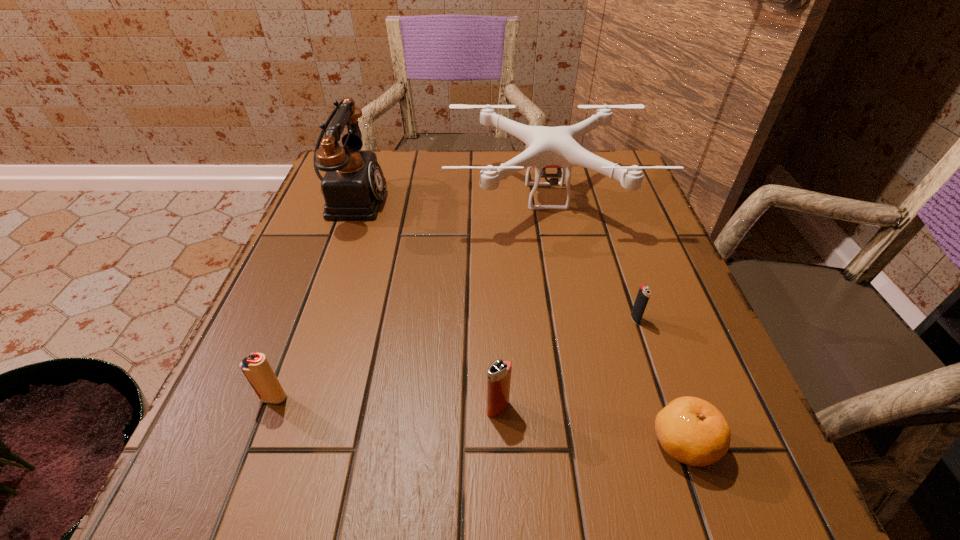
Identify which object is the fourth closest to the telephone. Please provide its 2D coordinates. Your answer should be formatted as a tuple, i.e. [(x, y)], where the tuple contains the x and y coordinates of a point satisfying the conditions above.

[(644, 292)]

You are a GUI agent. You are given a task and a screenshot of the screen. Output one action in this format:
    pyautogui.click(x=<x>, y=<y>)
    Task: Click on the object that ranks as the second closest to the drone
    The width and height of the screenshot is (960, 540).
    Given the screenshot: What is the action you would take?
    pyautogui.click(x=644, y=292)

This screenshot has width=960, height=540. Identify the location of igniter that is the second closest to the leftmost igniter. (644, 292).

You are a GUI agent. You are given a task and a screenshot of the screen. Output one action in this format:
    pyautogui.click(x=<x>, y=<y>)
    Task: Click on the igniter that stands as the closest to the telephone
    This screenshot has height=540, width=960.
    Given the screenshot: What is the action you would take?
    pyautogui.click(x=256, y=368)

This screenshot has height=540, width=960. In order to click on vacant space that satisfies the following two spatial constraints: 1. on the top of the drone; 2. on the front of the tallest object at the rotary dial in this screenshot , I will do `click(546, 198)`.

At what (x,y) coordinates should I click in order to perform the action: click on free space that satisfies the following two spatial constraints: 1. on the front side of the leftmost igniter; 2. on the left side of the clementine. Please return your answer as a coordinate pair (x, y). The height and width of the screenshot is (540, 960). Looking at the image, I should click on (257, 443).

I want to click on vacant region that satisfies the following two spatial constraints: 1. on the top of the second tallest object; 2. on the front of the telephone at the rotary dial, so click(x=546, y=198).

I want to click on vacant space that satisfies the following two spatial constraints: 1. on the back side of the clementine; 2. on the front of the tallest object at the rotary dial, so click(x=599, y=198).

This screenshot has height=540, width=960. I want to click on vacant point that satisfies the following two spatial constraints: 1. on the front side of the second igniter from right to left; 2. on the left side of the leftmost igniter, so click(270, 408).

What are the coordinates of `free spot that satisfies the following two spatial constraints: 1. on the front of the telephone at the rotary dial; 2. on the right side of the farthest igniter` in the screenshot? It's located at (306, 319).